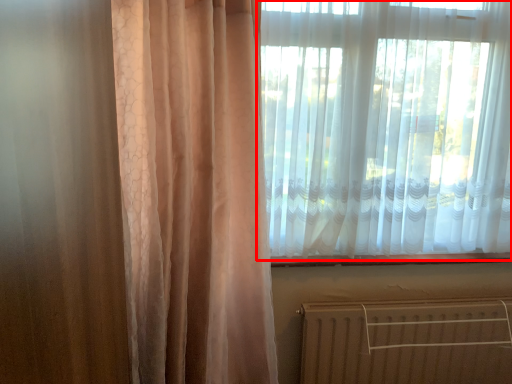
Question: From the image's perspective, considering the relative positions of curtain (annotated by the red box) and radiator in the image provided, where is curtain (annotated by the red box) located with respect to the staircase?

Choices:
 (A) above
 (B) below

Answer: (A)